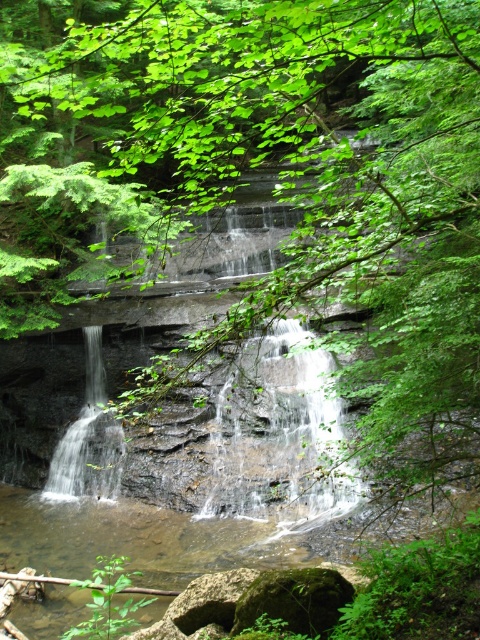
Between point (313, 490) and point (55, 484), which one is positioned behind?

The point (55, 484) is behind.

Between point (286, 387) and point (87, 387), which one is positioned in front?

Point (286, 387) is in front.

Who is more distant from viewer, (338, 468) or (113, 474)?

Point (113, 474)

Where is `smooth gray rock at center`? The width and height of the screenshot is (480, 640). smooth gray rock at center is located at coordinates (277, 432).